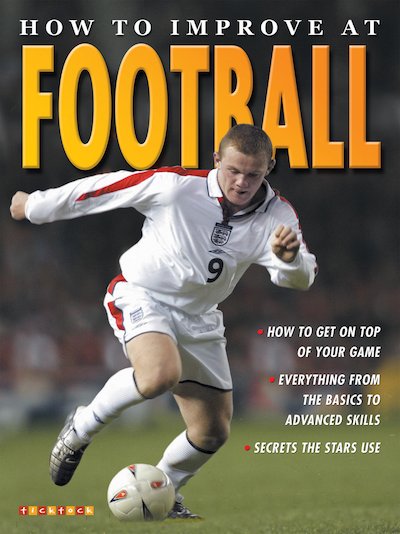
You are a GUI agent. You are given a task and a screenshot of the screen. Output one action in this format:
    pyautogui.click(x=<x>, y=<y>)
    Task: Click on the sock
    This screenshot has height=534, width=400.
    Given the screenshot: What is the action you would take?
    [188, 465], [108, 402]